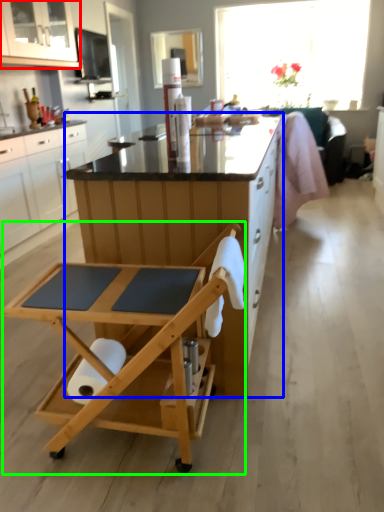
Question: Which is nearer to the cabinetry (highlighted by a red box)? desk (highlighted by a blue box) or table (highlighted by a green box).

Choices:
 (A) desk
 (B) table

Answer: (A)